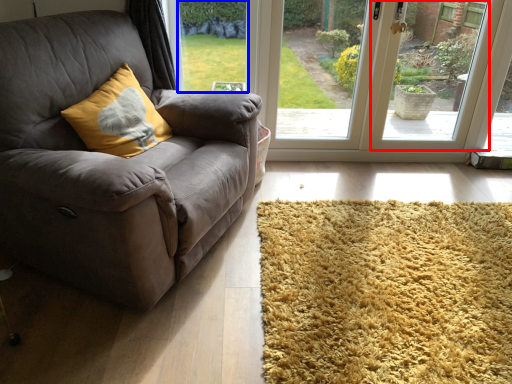
Question: Which object is closer to the camera taking this photo, window screen (highlighted by a red box) or window screen (highlighted by a blue box)?

Choices:
 (A) window screen
 (B) window screen

Answer: (A)